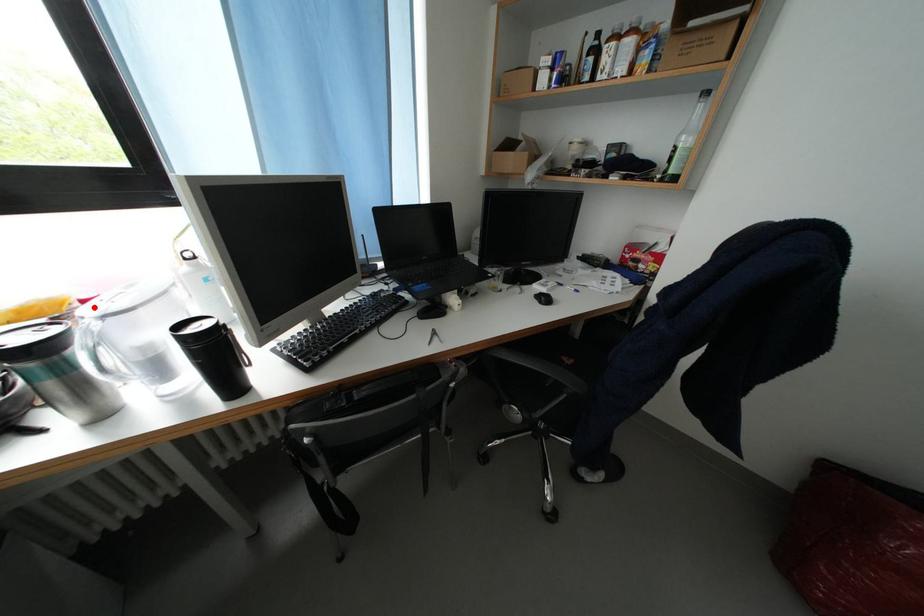
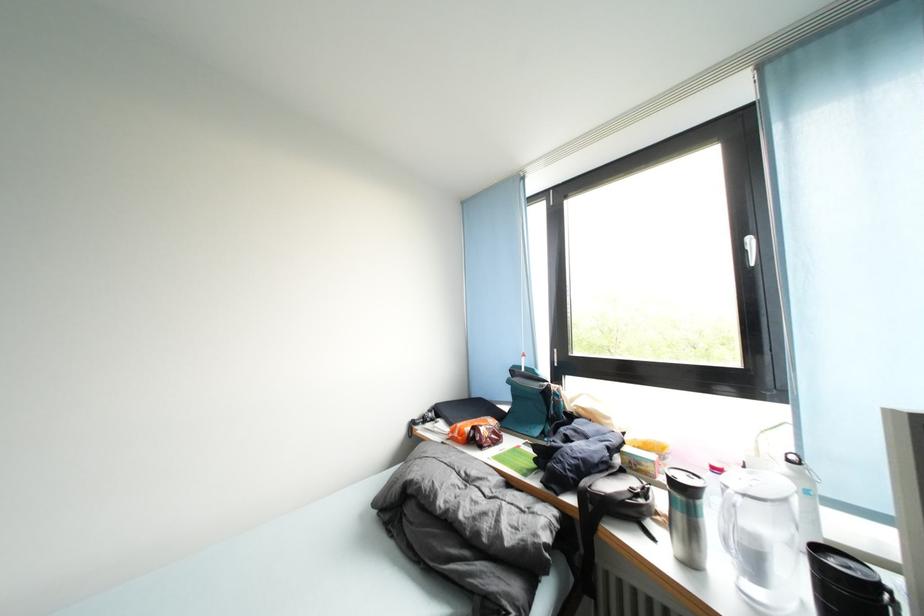
Question: I am providing you with two images of the same scene from different viewpoints. Image1 has a red point marked. In image2, the corresponding 3D location appears at what relative position? Reply with the corresponding letter.

Choices:
 (A) Closer
 (B) Farther

Answer: (B)